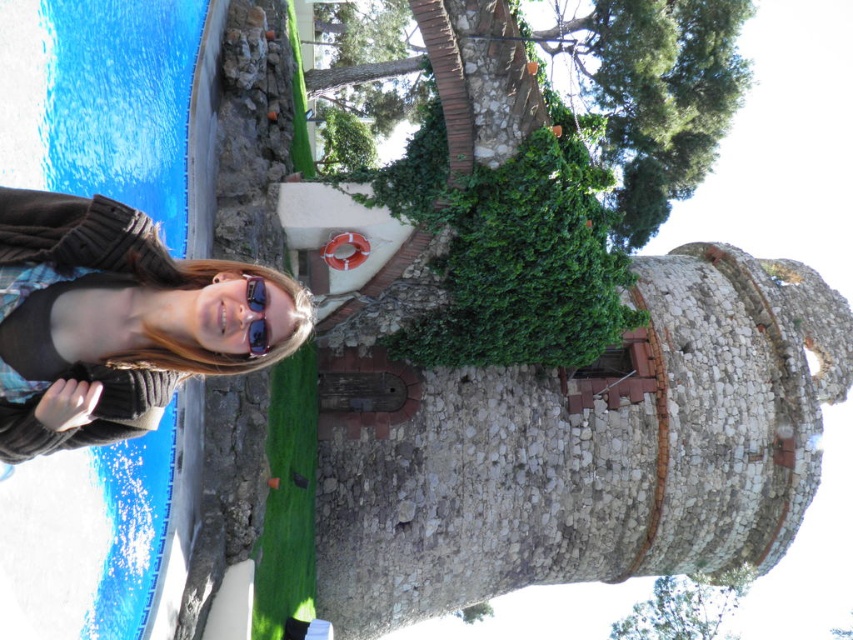
From the picture: You are a photographer trying to capture the person in the scene. You notice two pairs of sunglasses in the image. Which pair of sunglasses, the matte black sunglasses at upper left or the sunglasses at center, is larger in size?

The matte black sunglasses at upper left is bigger than the sunglasses at center.